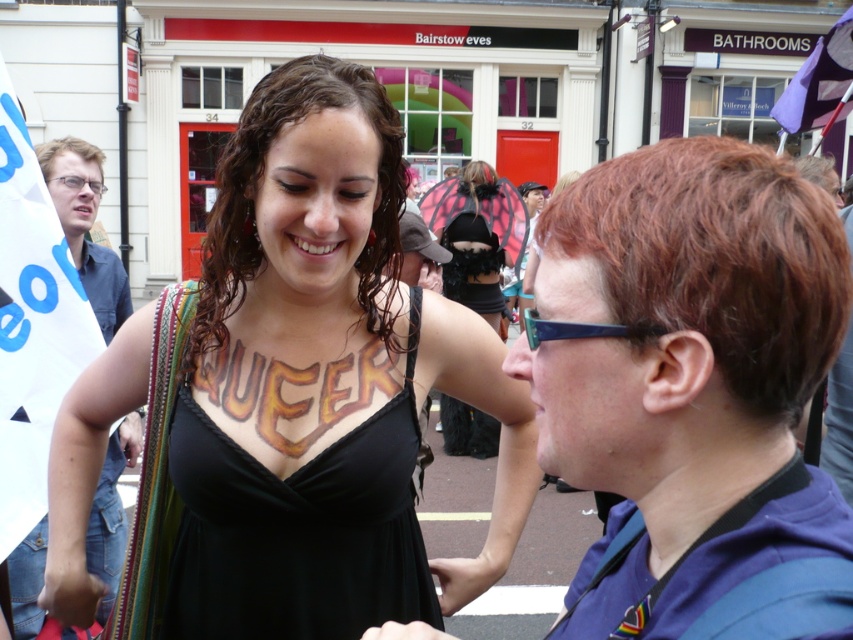
You are standing in the street scene and want to locate the black fabric dress at center. What are the coordinates where you should look?

The black fabric dress at center is located at coordinates point [270,518].

You are a photographer trying to capture both the black matte dress at center and the blue plastic glasses at upper center in a single frame. Given their sizes, which object should you focus on to ensure both are clearly visible in the photo?

The black matte dress at center is larger than the blue plastic glasses at upper center, so focusing on the black matte dress at center will help ensure both are clearly visible in the photo.

You are a photographer trying to capture a candid shot of the two people in the center of the scene. You notice the black fabric dress at center and the short brown hair at center. Which object is positioned to the left of the other?

The black fabric dress at center is to the left of the short brown hair at center.